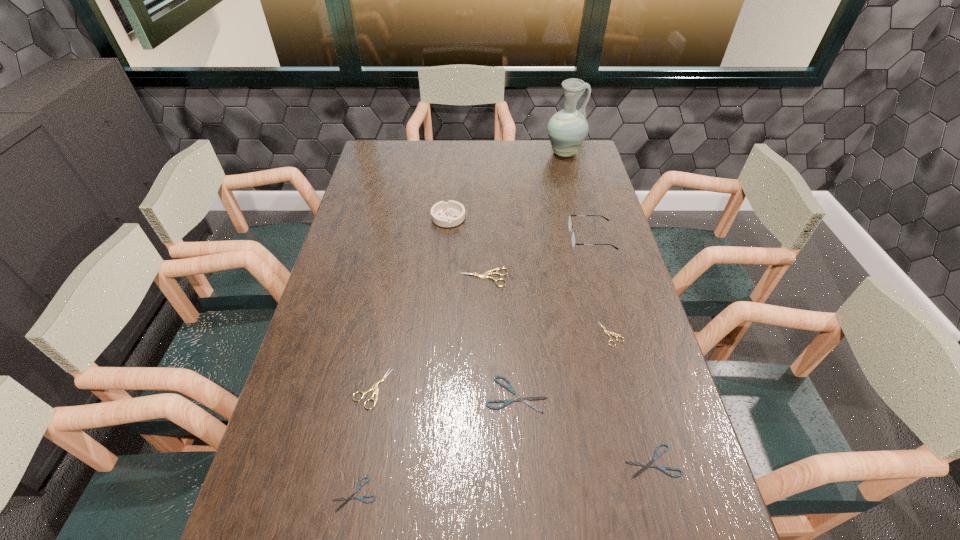
The image size is (960, 540). What are the coordinates of `pitcher` in the screenshot? It's located at (567, 129).

Locate an element on the screen. This screenshot has height=540, width=960. the farthest object is located at coordinates (567, 129).

Locate an element on the screen. The height and width of the screenshot is (540, 960). the second tallest object is located at coordinates (570, 227).

Find the location of a particular element. The height and width of the screenshot is (540, 960). black spectacles is located at coordinates (570, 227).

This screenshot has height=540, width=960. Find the location of `the third tallest object`. the third tallest object is located at coordinates (452, 213).

Locate an element on the screen. the farthest beige shears is located at coordinates (491, 272).

The image size is (960, 540). Find the location of `the fourth tallest object`. the fourth tallest object is located at coordinates (491, 272).

Where is `the leftmost beige shears`? This screenshot has width=960, height=540. the leftmost beige shears is located at coordinates (375, 386).

You are a GUI agent. You are given a task and a screenshot of the screen. Output one action in this format:
    pyautogui.click(x=<x>, y=<y>)
    Task: Click on the fifth shortest shears
    This screenshot has width=960, height=540.
    Given the screenshot: What is the action you would take?
    pyautogui.click(x=375, y=386)

At what (x,y) coordinates should I click in order to perform the action: click on the biggest black shears. Please return your answer as a coordinate pair (x, y). Looking at the image, I should click on (519, 398).